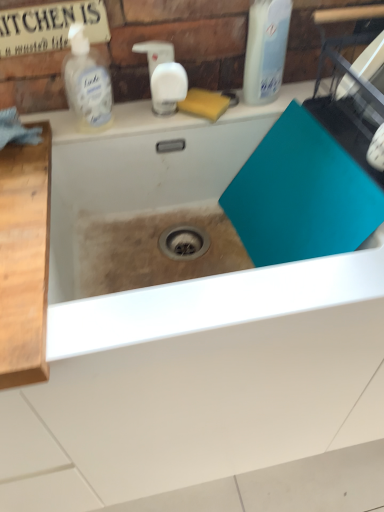
What is the approximate height of teal matte cutting board at center?

7.41 inches.

This screenshot has width=384, height=512. Describe the element at coordinates (87, 80) in the screenshot. I see `clear plastic bottle at upper left, marked as the second cleaning product in a right-to-left arrangement` at that location.

Find the location of a particular element. The image size is (384, 512). teal matte cutting board at center is located at coordinates (170, 208).

Looking at this image, from the image's perspective, which one is positioned lower, teal matte cutting board at center or translucent plastic bottle at upper right, which is the first cleaning product from right to left?

teal matte cutting board at center, from the image's perspective.

Is teal matte cutting board at center positioned beyond the bounds of translucent plastic bottle at upper right, which is the first cleaning product from right to left?

teal matte cutting board at center lies outside translucent plastic bottle at upper right, which is the first cleaning product from right to left,'s area.

Which object is thinner, teal matte cutting board at center or translucent plastic bottle at upper right, which is the first cleaning product from right to left?

translucent plastic bottle at upper right, which is the first cleaning product from right to left, is thinner.

Based on the photo, is teal matte cutting board at center not near translucent plastic bottle at upper right, the second cleaning product from the left?

No, teal matte cutting board at center is not far away from translucent plastic bottle at upper right, the second cleaning product from the left.

I want to click on cleaning product above the clear plastic bottle at upper left, positioned as the first cleaning product in left-to-right order (from a real-world perspective), so click(265, 50).

In the scene shown: Considering the positions of objects clear plastic bottle at upper left, positioned as the first cleaning product in left-to-right order, and translucent plastic bottle at upper right, the second cleaning product from the left, in the image provided, who is behind, clear plastic bottle at upper left, positioned as the first cleaning product in left-to-right order, or translucent plastic bottle at upper right, the second cleaning product from the left,?

clear plastic bottle at upper left, positioned as the first cleaning product in left-to-right order, is behind.

From the image's perspective, is clear plastic bottle at upper left, marked as the second cleaning product in a right-to-left arrangement, over translucent plastic bottle at upper right, the second cleaning product from the left?

No, from the image's perspective, clear plastic bottle at upper left, marked as the second cleaning product in a right-to-left arrangement, is not over translucent plastic bottle at upper right, the second cleaning product from the left.

How far apart are clear plastic bottle at upper left, positioned as the first cleaning product in left-to-right order, and translucent plastic bottle at upper right, the second cleaning product from the left?

A distance of 12.32 inches exists between clear plastic bottle at upper left, positioned as the first cleaning product in left-to-right order, and translucent plastic bottle at upper right, the second cleaning product from the left.

Which of these two, teal matte cutting board at center or clear plastic bottle at upper left, positioned as the first cleaning product in left-to-right order, stands shorter?

clear plastic bottle at upper left, positioned as the first cleaning product in left-to-right order, is shorter.

Considering the sizes of objects teal matte cutting board at center and clear plastic bottle at upper left, marked as the second cleaning product in a right-to-left arrangement, in the image provided, who is smaller, teal matte cutting board at center or clear plastic bottle at upper left, marked as the second cleaning product in a right-to-left arrangement,?

Smaller between the two is clear plastic bottle at upper left, marked as the second cleaning product in a right-to-left arrangement.

Between teal matte cutting board at center and clear plastic bottle at upper left, marked as the second cleaning product in a right-to-left arrangement, which one has larger width?

teal matte cutting board at center is wider.

Does point (124, 119) come in front of point (95, 116)?

No, it is behind (95, 116).

Would you say translucent plastic bottle at upper right, the second cleaning product from the left, is inside or outside clear plastic bottle at upper left, marked as the second cleaning product in a right-to-left arrangement?

translucent plastic bottle at upper right, the second cleaning product from the left, lies outside clear plastic bottle at upper left, marked as the second cleaning product in a right-to-left arrangement.

Which object is positioned more to the left, translucent plastic bottle at upper right, which is the first cleaning product from right to left, or clear plastic bottle at upper left, positioned as the first cleaning product in left-to-right order?

clear plastic bottle at upper left, positioned as the first cleaning product in left-to-right order, is more to the left.

Could you tell me if translucent plastic bottle at upper right, which is the first cleaning product from right to left, is facing clear plastic bottle at upper left, positioned as the first cleaning product in left-to-right order?

No, translucent plastic bottle at upper right, which is the first cleaning product from right to left, is not aimed at clear plastic bottle at upper left, positioned as the first cleaning product in left-to-right order.

Measure the distance between translucent plastic bottle at upper right, which is the first cleaning product from right to left, and clear plastic bottle at upper left, marked as the second cleaning product in a right-to-left arrangement.

translucent plastic bottle at upper right, which is the first cleaning product from right to left, and clear plastic bottle at upper left, marked as the second cleaning product in a right-to-left arrangement, are 12.32 inches apart from each other.

Who is smaller, translucent plastic bottle at upper right, the second cleaning product from the left, or teal matte cutting board at center?

Smaller between the two is translucent plastic bottle at upper right, the second cleaning product from the left.

What's the angular difference between translucent plastic bottle at upper right, which is the first cleaning product from right to left, and teal matte cutting board at center's facing directions?

The angular difference between translucent plastic bottle at upper right, which is the first cleaning product from right to left, and teal matte cutting board at center is 3.07 degrees.

Is translucent plastic bottle at upper right, the second cleaning product from the left, completely or partially outside of teal matte cutting board at center?

Yes.

Is translucent plastic bottle at upper right, the second cleaning product from the left, next to teal matte cutting board at center?

No, translucent plastic bottle at upper right, the second cleaning product from the left, is not making contact with teal matte cutting board at center.

Is clear plastic bottle at upper left, positioned as the first cleaning product in left-to-right order, positioned with its back to teal matte cutting board at center?

That's not correct — clear plastic bottle at upper left, positioned as the first cleaning product in left-to-right order, is not looking away from teal matte cutting board at center.

Considering the sizes of clear plastic bottle at upper left, positioned as the first cleaning product in left-to-right order, and teal matte cutting board at center in the image, is clear plastic bottle at upper left, positioned as the first cleaning product in left-to-right order, wider or thinner than teal matte cutting board at center?

Considering their sizes, clear plastic bottle at upper left, positioned as the first cleaning product in left-to-right order, looks slimmer than teal matte cutting board at center.

Would you say teal matte cutting board at center is part of clear plastic bottle at upper left, marked as the second cleaning product in a right-to-left arrangement,'s contents?

No, teal matte cutting board at center is not surrounded by clear plastic bottle at upper left, marked as the second cleaning product in a right-to-left arrangement.

Can you confirm if clear plastic bottle at upper left, positioned as the first cleaning product in left-to-right order, is smaller than teal matte cutting board at center?

Indeed, clear plastic bottle at upper left, positioned as the first cleaning product in left-to-right order, has a smaller size compared to teal matte cutting board at center.

Starting from the teal matte cutting board at center, which cleaning product is the 1st one behind? Please provide its 2D coordinates.

[(265, 50)]

Identify the location of cleaning product on the left of translucent plastic bottle at upper right, which is the first cleaning product from right to left. (87, 80).

In the scene shown: When comparing their distances from translucent plastic bottle at upper right, which is the first cleaning product from right to left, does clear plastic bottle at upper left, positioned as the first cleaning product in left-to-right order, or teal matte cutting board at center seem further?

clear plastic bottle at upper left, positioned as the first cleaning product in left-to-right order.

Estimate the real-world distances between objects in this image. Which object is further from teal matte cutting board at center, translucent plastic bottle at upper right, the second cleaning product from the left, or clear plastic bottle at upper left, marked as the second cleaning product in a right-to-left arrangement?

translucent plastic bottle at upper right, the second cleaning product from the left.

From the image, which object appears to be farther from teal matte cutting board at center, clear plastic bottle at upper left, positioned as the first cleaning product in left-to-right order, or translucent plastic bottle at upper right, the second cleaning product from the left?

translucent plastic bottle at upper right, the second cleaning product from the left, is positioned further to the anchor teal matte cutting board at center.

Considering their positions, is teal matte cutting board at center positioned further to clear plastic bottle at upper left, positioned as the first cleaning product in left-to-right order, than translucent plastic bottle at upper right, which is the first cleaning product from right to left?

Based on the image, translucent plastic bottle at upper right, which is the first cleaning product from right to left, appears to be further to clear plastic bottle at upper left, positioned as the first cleaning product in left-to-right order.

From the picture: Based on their spatial positions, is translucent plastic bottle at upper right, the second cleaning product from the left, or teal matte cutting board at center closer to clear plastic bottle at upper left, positioned as the first cleaning product in left-to-right order?

teal matte cutting board at center is closer to clear plastic bottle at upper left, positioned as the first cleaning product in left-to-right order.

Considering their positions, is teal matte cutting board at center positioned further to translucent plastic bottle at upper right, the second cleaning product from the left, than clear plastic bottle at upper left, marked as the second cleaning product in a right-to-left arrangement?

clear plastic bottle at upper left, marked as the second cleaning product in a right-to-left arrangement, is positioned further to the anchor translucent plastic bottle at upper right, the second cleaning product from the left.

Identify the location of bath between clear plastic bottle at upper left, positioned as the first cleaning product in left-to-right order, and translucent plastic bottle at upper right, which is the first cleaning product from right to left, in the horizontal direction. (170, 208).